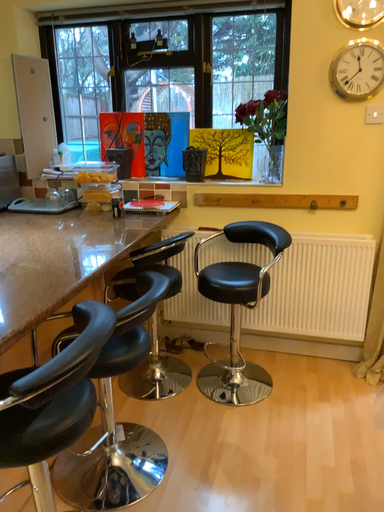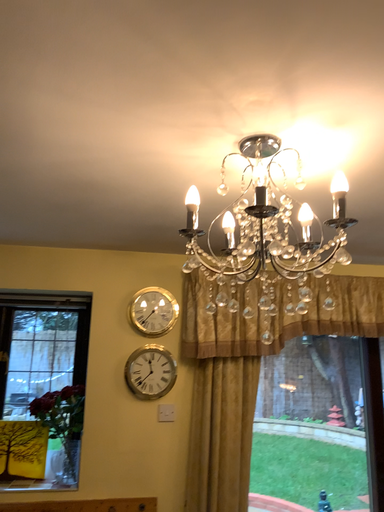
Question: Which way did the camera rotate in the video?

Choices:
 (A) rotated left
 (B) rotated right

Answer: (B)